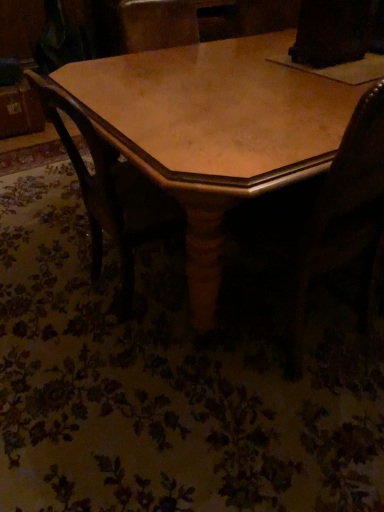
Question: Considering the positions of wooden table at center and wooden chair at center in the image, is wooden table at center taller or shorter than wooden chair at center?

Choices:
 (A) short
 (B) tall

Answer: (A)

Question: In the image, is wooden table at center positioned in front of or behind wooden chair at center?

Choices:
 (A) behind
 (B) front

Answer: (B)

Question: Which is nearer to the wooden chair at center?

Choices:
 (A) wooden swivel chair at center
 (B) wooden table at center

Answer: (B)

Question: Based on their relative distances, which object is farther from the wooden table at center?

Choices:
 (A) wooden chair at center
 (B) wooden swivel chair at center

Answer: (B)